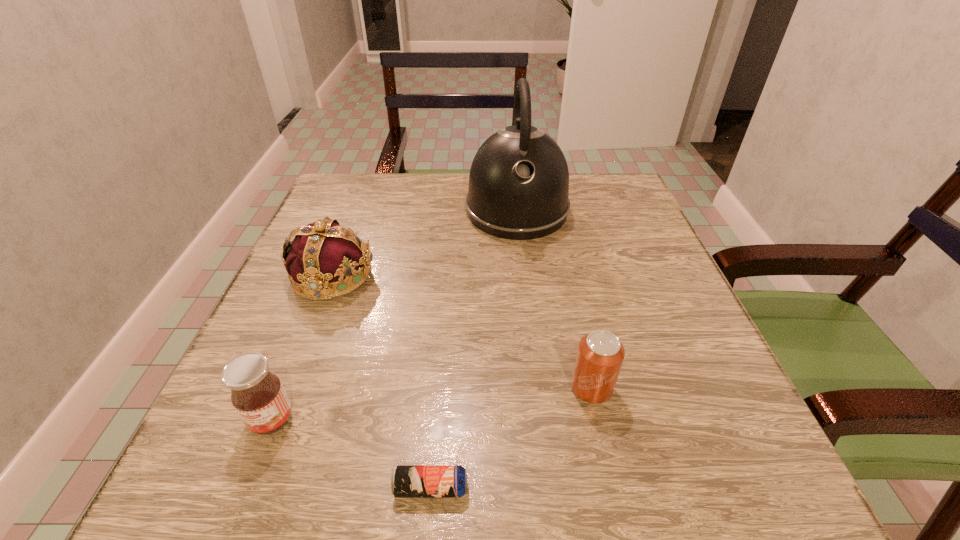
Find the location of a particular element. This screenshot has width=960, height=540. unoccupied position between the fourth nearest object and the can is located at coordinates (462, 332).

I want to click on free spot between the tallest object and the can, so (x=554, y=299).

Where is `object that is the third closest one to the jam`? The width and height of the screenshot is (960, 540). object that is the third closest one to the jam is located at coordinates (600, 355).

Locate which object is the second closest to the shortest object. Please provide its 2D coordinates. Your answer should be formatted as a tuple, i.e. [(x, y)], where the tuple contains the x and y coordinates of a point satisfying the conditions above.

[(600, 355)]

You are a GUI agent. You are given a task and a screenshot of the screen. Output one action in this format:
    pyautogui.click(x=<x>, y=<y>)
    Task: Click on the vacant space that satisfies the following two spatial constraints: 1. on the label side of the jam; 2. on the left side of the beer can
    The height and width of the screenshot is (540, 960).
    Given the screenshot: What is the action you would take?
    pyautogui.click(x=245, y=488)

Find the location of `vacant region that satisfies the following two spatial constraints: 1. on the label side of the beer can; 2. on the right side of the jam`. vacant region that satisfies the following two spatial constraints: 1. on the label side of the beer can; 2. on the right side of the jam is located at coordinates (245, 488).

The image size is (960, 540). Identify the location of free space that satisfies the following two spatial constraints: 1. on the front side of the can; 2. on the right side of the crown. (289, 388).

You are a GUI agent. You are given a task and a screenshot of the screen. Output one action in this format:
    pyautogui.click(x=<x>, y=<y>)
    Task: Click on the vacant position in the image that satisfies the following two spatial constraints: 1. on the front side of the crown; 2. on the right side of the can
    The height and width of the screenshot is (540, 960).
    Given the screenshot: What is the action you would take?
    pyautogui.click(x=289, y=388)

Where is `free space that satisfies the following two spatial constraints: 1. on the label side of the jam; 2. on the left side of the beer can`? The width and height of the screenshot is (960, 540). free space that satisfies the following two spatial constraints: 1. on the label side of the jam; 2. on the left side of the beer can is located at coordinates (245, 488).